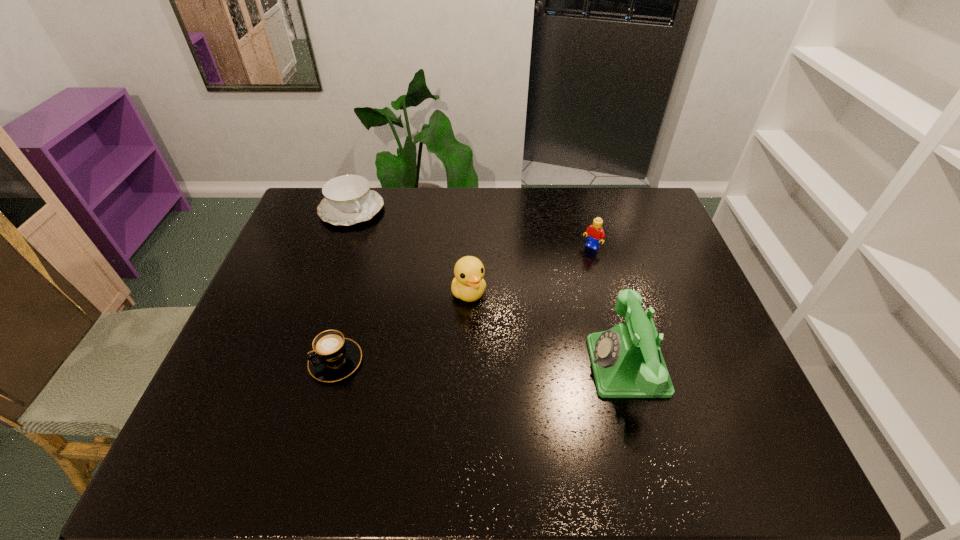
In order to click on cappuccino in this screenshot , I will do `click(333, 358)`.

The height and width of the screenshot is (540, 960). In order to click on the tallest object in this screenshot , I will do `click(627, 362)`.

You are a GUI agent. You are given a task and a screenshot of the screen. Output one action in this format:
    pyautogui.click(x=<x>, y=<y>)
    Task: Click on the third nearest object
    
    Given the screenshot: What is the action you would take?
    pyautogui.click(x=468, y=285)

Where is `the fourth shortest object`? the fourth shortest object is located at coordinates (468, 285).

The width and height of the screenshot is (960, 540). Find the location of `the farthest object`. the farthest object is located at coordinates (347, 200).

Locate an element on the screen. The height and width of the screenshot is (540, 960). the fourth nearest object is located at coordinates (595, 234).

The width and height of the screenshot is (960, 540). I want to click on the third tallest object, so click(595, 234).

You are a GUI agent. You are given a task and a screenshot of the screen. Output one action in this format:
    pyautogui.click(x=<x>, y=<y>)
    Task: Click on the free spot located 0.170m on the right of the cappuccino
    Image resolution: width=960 pixels, height=540 pixels.
    Given the screenshot: What is the action you would take?
    pyautogui.click(x=431, y=361)

Locate an element on the screen. This screenshot has width=960, height=540. vacant space situated on the dial of the telephone is located at coordinates (501, 366).

Where is `free space located 0.080m on the dial of the telephone`? free space located 0.080m on the dial of the telephone is located at coordinates (558, 366).